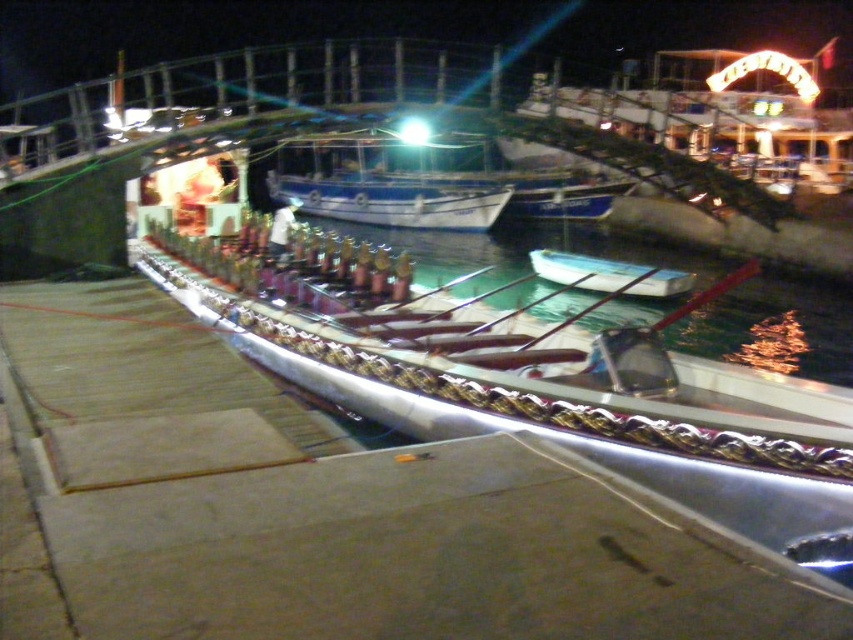
Question: Which of these objects is positioned farthest from the white glossy boat at center?

Choices:
 (A) blue glossy boat at center
 (B) clear water at center

Answer: (A)

Question: Is blue glossy boat at center to the left of white glossy boat at center from the viewer's perspective?

Choices:
 (A) yes
 (B) no

Answer: (A)

Question: From the image, what is the correct spatial relationship of clear water at center in relation to white glossy boat at center?

Choices:
 (A) below
 (B) above

Answer: (B)

Question: Based on their relative distances, which object is nearer to the clear water at center?

Choices:
 (A) white glossy boat at center
 (B) blue glossy boat at center

Answer: (A)

Question: Can you confirm if blue glossy boat at center is positioned above white glossy boat at center?

Choices:
 (A) yes
 (B) no

Answer: (A)

Question: Which point is farther from the camera taking this photo?

Choices:
 (A) (x=616, y=189)
 (B) (x=605, y=266)

Answer: (A)